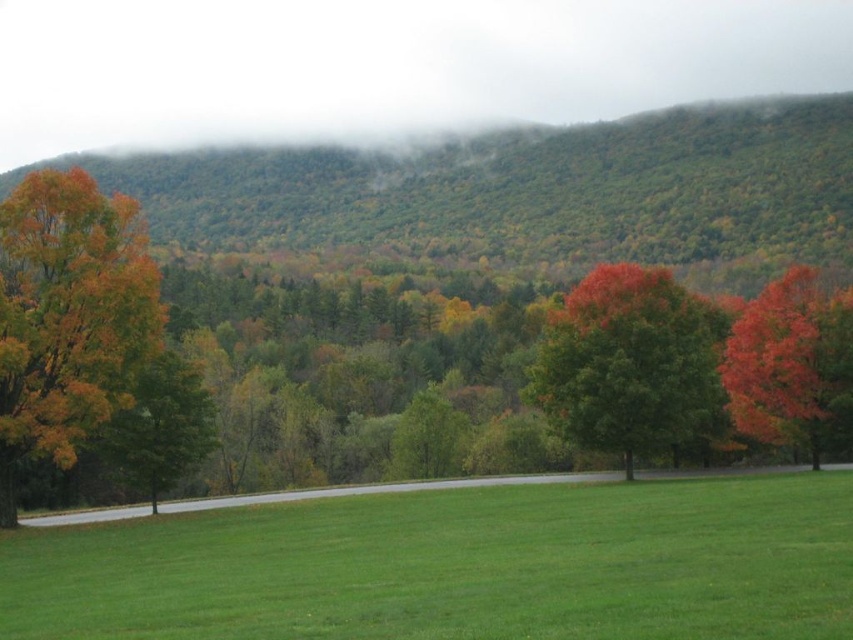
Does green grassy field at center have a lesser width compared to bright red leafy tree at right?

Indeed, green grassy field at center has a lesser width compared to bright red leafy tree at right.

Does green grassy field at center have a greater width compared to bright red leafy tree at right?

Incorrect, green grassy field at center's width does not surpass bright red leafy tree at right's.

You are a GUI agent. You are given a task and a screenshot of the screen. Output one action in this format:
    pyautogui.click(x=<x>, y=<y>)
    Task: Click on the green grassy field at center
    
    Given the screenshot: What is the action you would take?
    pyautogui.click(x=456, y=566)

The image size is (853, 640). I want to click on green grassy field at center, so click(x=456, y=566).

Is green grassy field at center bigger than shiny red tree at center?

Yes.

Who is positioned more to the right, green grassy field at center or shiny red tree at center?

From the viewer's perspective, shiny red tree at center appears more on the right side.

Does point (250, 588) lie in front of point (646, 280)?

Yes, point (250, 588) is closer to viewer.

This screenshot has height=640, width=853. I want to click on green grassy field at center, so click(456, 566).

Does orange leafy tree at left come behind bright red leafy tree at right?

That is False.

I want to click on orange leafy tree at left, so click(68, 317).